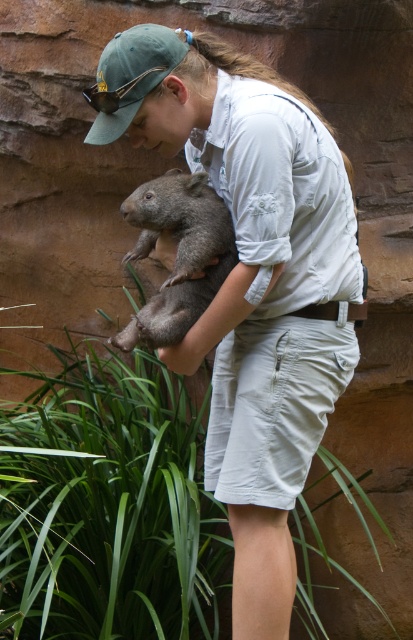
Question: Which point is closer to the camera?

Choices:
 (A) (225, 380)
 (B) (199, 237)

Answer: (B)

Question: Does light gray cotton shirt at center have a lesser width compared to fuzzy gray wombat at center?

Choices:
 (A) yes
 (B) no

Answer: (B)

Question: Among these points, which one is nearest to the camera?

Choices:
 (A) (298, 90)
 (B) (182, 225)

Answer: (B)

Question: Is the position of light gray cotton shirt at center less distant than that of fuzzy gray wombat at center?

Choices:
 (A) no
 (B) yes

Answer: (B)

Question: Which point is farther from the camera taking this photo?

Choices:
 (A) (159, 74)
 (B) (204, 259)

Answer: (B)

Question: Does light gray cotton shirt at center appear on the right side of fuzzy gray wombat at center?

Choices:
 (A) no
 (B) yes

Answer: (B)